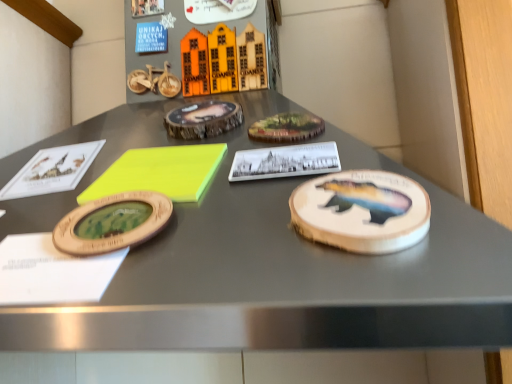
What do you see at coordinates (362, 211) in the screenshot?
I see `wooden coaster with bear design at right` at bounding box center [362, 211].

Where is `wooden coaster with bear design at right`? The image size is (512, 384). wooden coaster with bear design at right is located at coordinates (362, 211).

This screenshot has height=384, width=512. Describe the element at coordinates (160, 172) in the screenshot. I see `neon yellow foam at center` at that location.

This screenshot has width=512, height=384. What are the coordinates of `neon yellow foam at center` in the screenshot? It's located at (160, 172).

Locate an element on the screen. The height and width of the screenshot is (384, 512). wooden coaster with bear design at right is located at coordinates (362, 211).

Between wooden coaster with bear design at right and neon yellow foam at center, which one appears on the left side from the viewer's perspective?

From the viewer's perspective, neon yellow foam at center appears more on the left side.

Is wooden coaster with bear design at right further to camera compared to neon yellow foam at center?

No, wooden coaster with bear design at right is closer to the camera.

Considering the points (389, 245) and (172, 170), which point is in front, point (389, 245) or point (172, 170)?

The point (389, 245) is closer to the camera.

From the image's perspective, between wooden coaster with bear design at right and neon yellow foam at center, which one is located above?

From the image's view, neon yellow foam at center is above.

From a real-world perspective, is wooden coaster with bear design at right positioned above or below neon yellow foam at center?

From a real-world perspective, wooden coaster with bear design at right is physically below neon yellow foam at center.

Can you confirm if wooden coaster with bear design at right is thinner than neon yellow foam at center?

Yes, wooden coaster with bear design at right is thinner than neon yellow foam at center.

Which of these two, wooden coaster with bear design at right or neon yellow foam at center, stands shorter?

wooden coaster with bear design at right is shorter.

Based on the photo, is wooden coaster with bear design at right bigger than neon yellow foam at center?

No, wooden coaster with bear design at right is not bigger than neon yellow foam at center.

Which is correct: wooden coaster with bear design at right is inside neon yellow foam at center, or outside of it?

wooden coaster with bear design at right is not enclosed by neon yellow foam at center.

Is wooden coaster with bear design at right not close to neon yellow foam at center?

No, wooden coaster with bear design at right is not far from neon yellow foam at center.

Does wooden coaster with bear design at right turn towards neon yellow foam at center?

No, wooden coaster with bear design at right does not turn towards neon yellow foam at center.

You are a GUI agent. You are given a task and a screenshot of the screen. Output one action in this format:
    pyautogui.click(x=<x>, y=<y>)
    Task: Click on the notepad on the left side of wooden coaster with bear design at right
    Image resolution: width=512 pixels, height=384 pixels.
    Given the screenshot: What is the action you would take?
    pyautogui.click(x=160, y=172)

Between neon yellow foam at center and wooden coaster with bear design at right, which one appears on the left side from the viewer's perspective?

neon yellow foam at center is more to the left.

Who is more distant, neon yellow foam at center or wooden coaster with bear design at right?

neon yellow foam at center is further away from the camera.

Which is more distant, (193, 182) or (305, 183)?

Positioned behind is point (193, 182).

From the image's perspective, between neon yellow foam at center and wooden coaster with bear design at right, who is located below?

wooden coaster with bear design at right appears lower in the image.

From a real-world perspective, is neon yellow foam at center physically located above or below wooden coaster with bear design at right?

From a real-world perspective, neon yellow foam at center is physically above wooden coaster with bear design at right.

In terms of width, does neon yellow foam at center look wider or thinner when compared to wooden coaster with bear design at right?

In the image, neon yellow foam at center appears to be wider than wooden coaster with bear design at right.

Between neon yellow foam at center and wooden coaster with bear design at right, which one has more height?

With more height is neon yellow foam at center.

Considering the sizes of neon yellow foam at center and wooden coaster with bear design at right in the image, is neon yellow foam at center bigger or smaller than wooden coaster with bear design at right?

Clearly, neon yellow foam at center is larger in size than wooden coaster with bear design at right.

Could wooden coaster with bear design at right be considered to be inside neon yellow foam at center?

No, wooden coaster with bear design at right is not inside neon yellow foam at center.

Would you say neon yellow foam at center is a long distance from wooden coaster with bear design at right?

No, neon yellow foam at center is in close proximity to wooden coaster with bear design at right.

Is neon yellow foam at center looking in the opposite direction of wooden coaster with bear design at right?

No, neon yellow foam at center is not facing the opposite direction of wooden coaster with bear design at right.

I want to click on notepad on the left of wooden coaster with bear design at right, so click(x=160, y=172).

Locate an element on the screen. cake lying on the right of neon yellow foam at center is located at coordinates (362, 211).

Find the location of a particular element. This screenshot has width=512, height=384. notepad lying above the wooden coaster with bear design at right (from the image's perspective) is located at coordinates (160, 172).